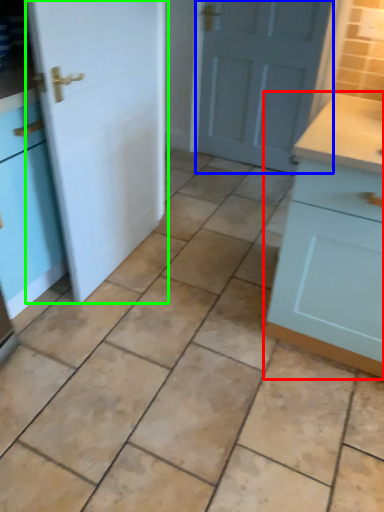
Question: Which is nearer to the cabinetry (highlighted by a red box)? door (highlighted by a blue box) or door (highlighted by a green box).

Choices:
 (A) door
 (B) door

Answer: (B)